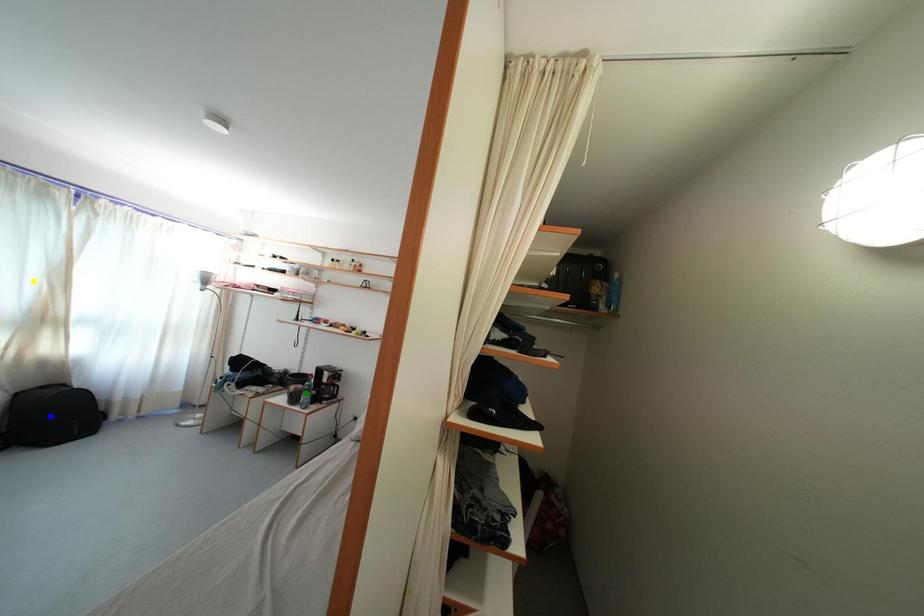
Order these from nearest to farthest:
A) blue point
B) green point
C) yellow point

1. green point
2. blue point
3. yellow point